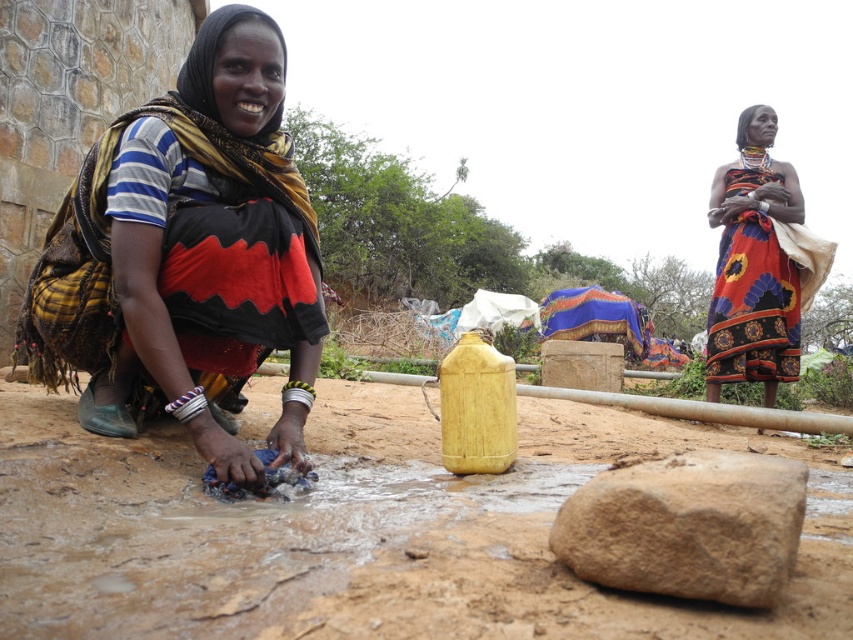
You are a photographer setting up a shot of the two women. You want to ensure the brown rough rock at lower center and the floral fabric dress at upper right are both visible in the frame. Which object should you focus on first to ensure both are in focus?

The brown rough rock at lower center is smaller than the floral fabric dress at upper right, so you should focus on the floral fabric dress at upper right first since larger objects are easier to keep in focus when framing both subjects.

You are standing at the edge of a small garden and see the matte black fabric at lower left and the brown rough rock at lower center. Which object is closer to your left side?

The matte black fabric at lower left is closer to your left side because it is positioned on the left side of the brown rough rock at lower center.